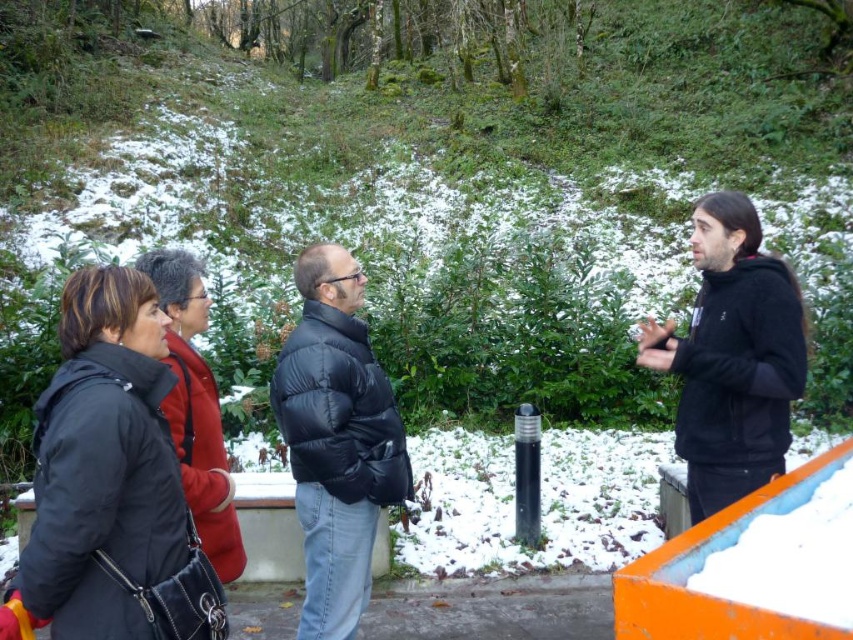
Question: Which object appears farthest from the camera in this image?

Choices:
 (A) matte black jacket at left
 (B) black hoodie at right

Answer: (B)

Question: From the image, what is the correct spatial relationship of black matte jacket at lower left in relation to black hoodie at right?

Choices:
 (A) below
 (B) above

Answer: (A)

Question: Which of the following is the closest to the observer?

Choices:
 (A) black hoodie at right
 (B) matte black jacket at left

Answer: (B)

Question: Which point is farther to the camera?

Choices:
 (A) (374, 358)
 (B) (88, 442)
 (C) (741, 381)
 (D) (213, 424)

Answer: (A)

Question: Can you confirm if black matte jacket at lower left is positioned to the left of black puffy jacket at center?

Choices:
 (A) no
 (B) yes

Answer: (B)

Question: Can you confirm if black hoodie at right is wider than matte black jacket at left?

Choices:
 (A) no
 (B) yes

Answer: (B)